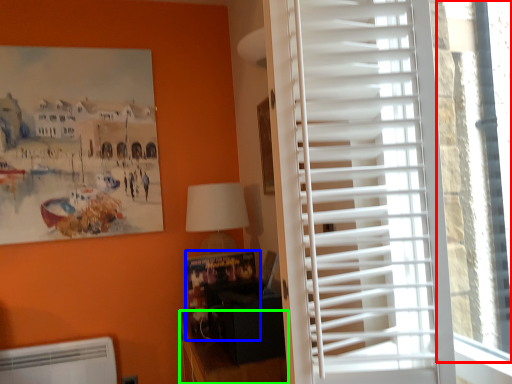
Question: Which object is the closest to the window screen (highlighted by a red box)? Choose among these: bulletin board (highlighted by a blue box) or furniture (highlighted by a green box).

Choices:
 (A) bulletin board
 (B) furniture

Answer: (B)